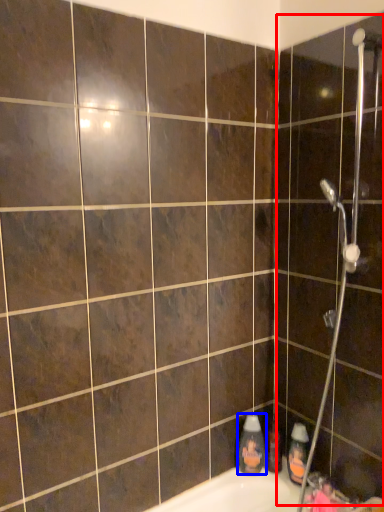
Question: Among these objects, which one is farthest to the camera, screen door (highlighted by a red box) or cleaning product (highlighted by a blue box)?

Choices:
 (A) screen door
 (B) cleaning product

Answer: (B)